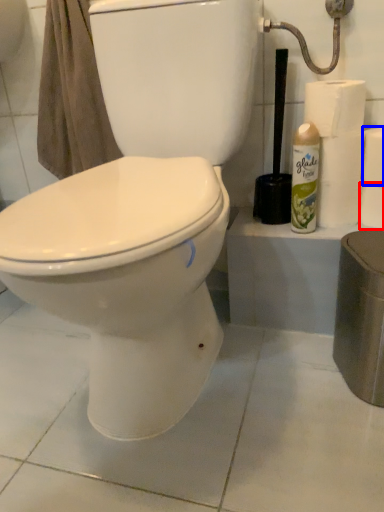
Question: Which of the following is the closest to the observer, toilet paper (highlighted by a red box) or toilet paper (highlighted by a blue box)?

Choices:
 (A) toilet paper
 (B) toilet paper

Answer: (B)